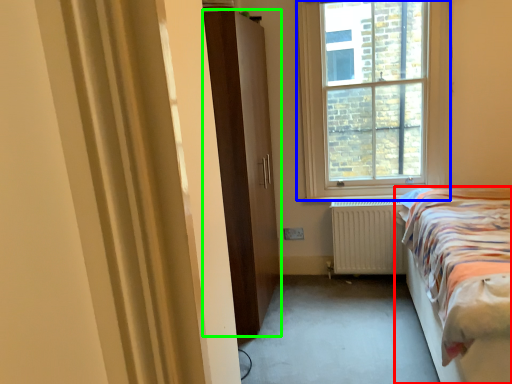
Question: Which is nearer to the bed (highlighted by a red box)? window (highlighted by a blue box) or door (highlighted by a green box).

Choices:
 (A) window
 (B) door

Answer: (A)